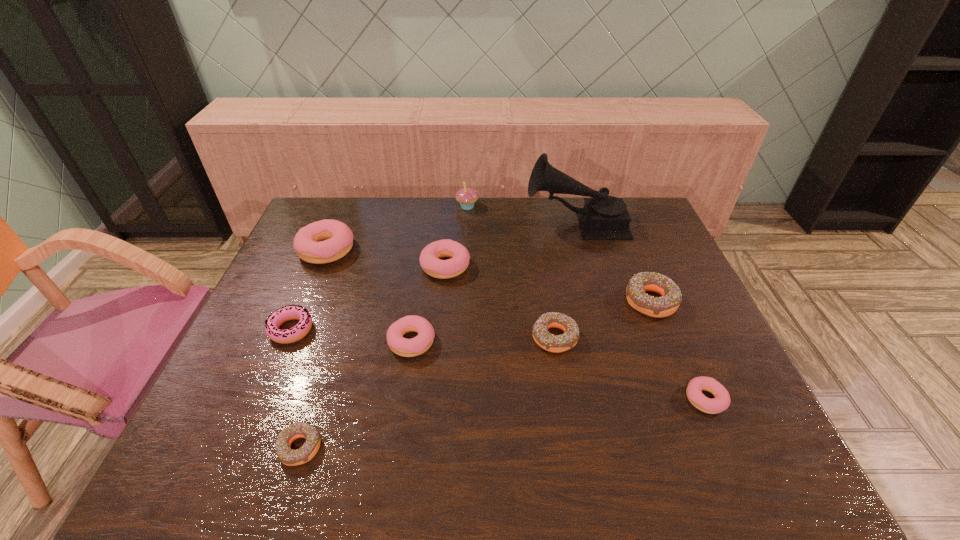
Find the location of a particular element. This screenshot has width=960, height=540. free space located 0.290m on the back of the second biggest pink doughnut is located at coordinates (451, 201).

Where is `vacant area situated on the front of the rightmost chocolate doughnut`? This screenshot has width=960, height=540. vacant area situated on the front of the rightmost chocolate doughnut is located at coordinates (672, 354).

Identify the location of vacant region located on the back of the third smallest pink doughnut. The width and height of the screenshot is (960, 540). (418, 305).

The image size is (960, 540). I want to click on vacant space located 0.120m on the front of the second smallest chocolate doughnut, so click(564, 398).

Locate an element on the screen. This screenshot has height=540, width=960. vacant space positioned 0.370m on the left of the nearest pink doughnut is located at coordinates (521, 400).

Identify the location of vacant area situated 0.240m on the back of the nearest doughnut. The width and height of the screenshot is (960, 540). (334, 341).

The image size is (960, 540). What are the coordinates of `phonograph_record positioned at the far edge` in the screenshot? It's located at (603, 217).

You are a GUI agent. You are given a task and a screenshot of the screen. Output one action in this format:
    pyautogui.click(x=<x>, y=<y>)
    Task: Click on the cupcake located in the far edge section of the desktop
    
    Given the screenshot: What is the action you would take?
    pyautogui.click(x=467, y=197)

The width and height of the screenshot is (960, 540). In order to click on doughnut that is positioned at the far edge in this screenshot , I will do (x=325, y=241).

Find the location of a particular element. The width and height of the screenshot is (960, 540). object that is at the near edge is located at coordinates (288, 456).